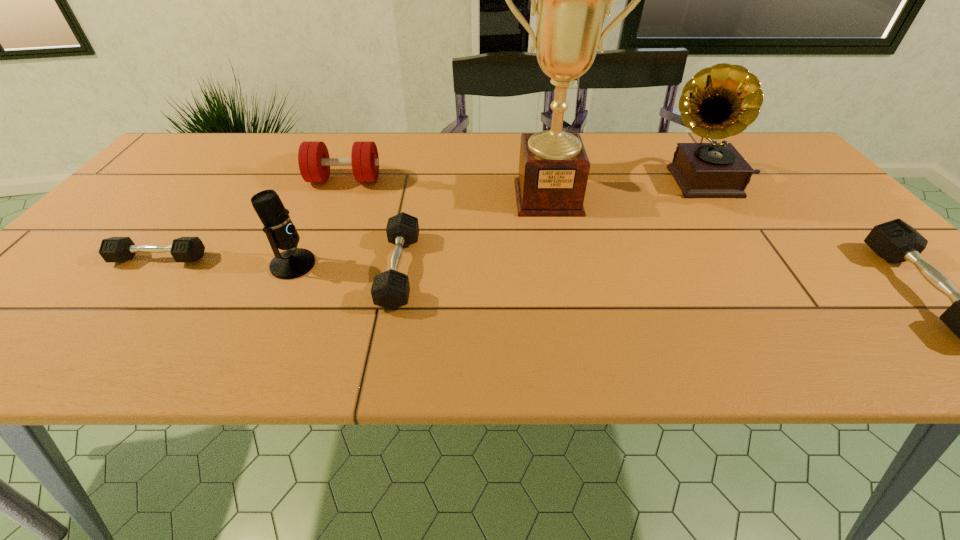
Locate an element on the screen. location for an additional dumbbell to make spacing equal is located at coordinates (653, 281).